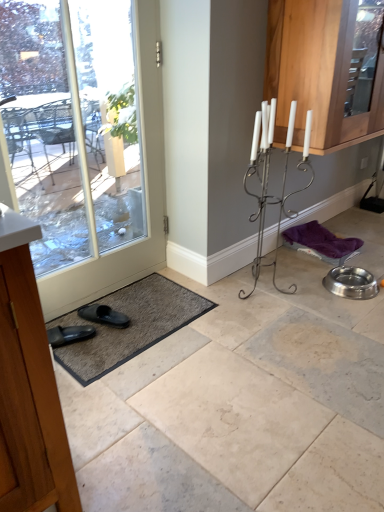
Find the location of a particular element. The image size is (384, 512). vacant space situated above gray textured bath mat at lower left (from a real-world perspective) is located at coordinates (127, 317).